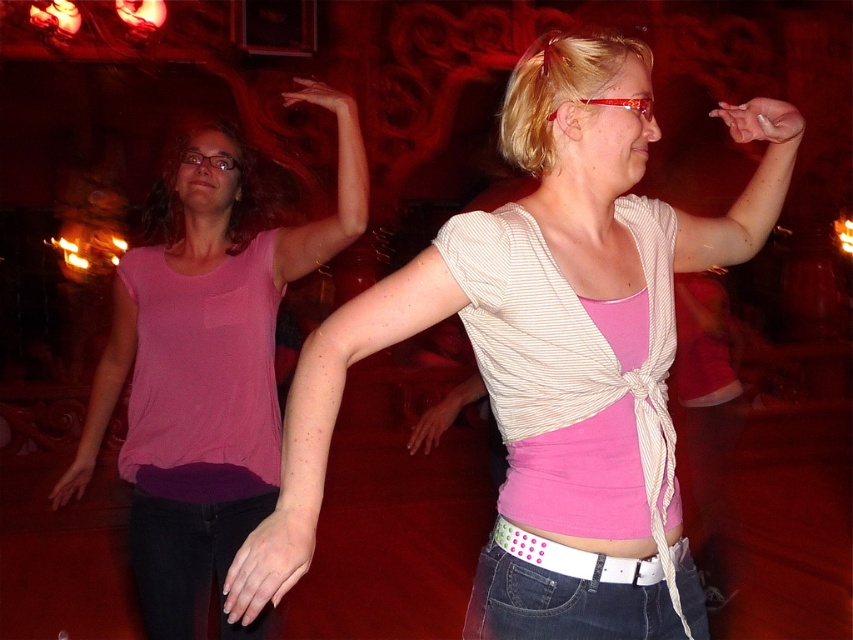
You are a photographer at the event and want to capture a clear photo of both the pink striped shirt at center and the pink fabric shirt at left. Which one should you focus on first to ensure both are in focus?

You should focus on the pink striped shirt at center first since it is closer to the viewer than the pink fabric shirt at left. By focusing on the closer object, the depth of field may allow the background object to be in focus as well.

In the scene shown: Based on the scene description, which object is positioned to the right of the other? Please state the relationship between the pink striped shirt at center and the pink fabric shirt at left.

The pink striped shirt at center is to the right of the pink fabric shirt at left.